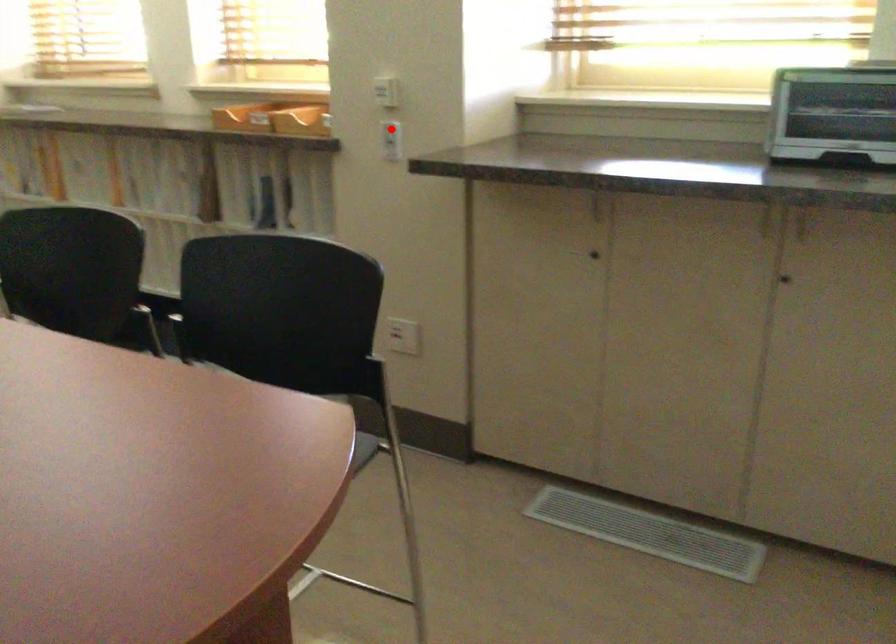
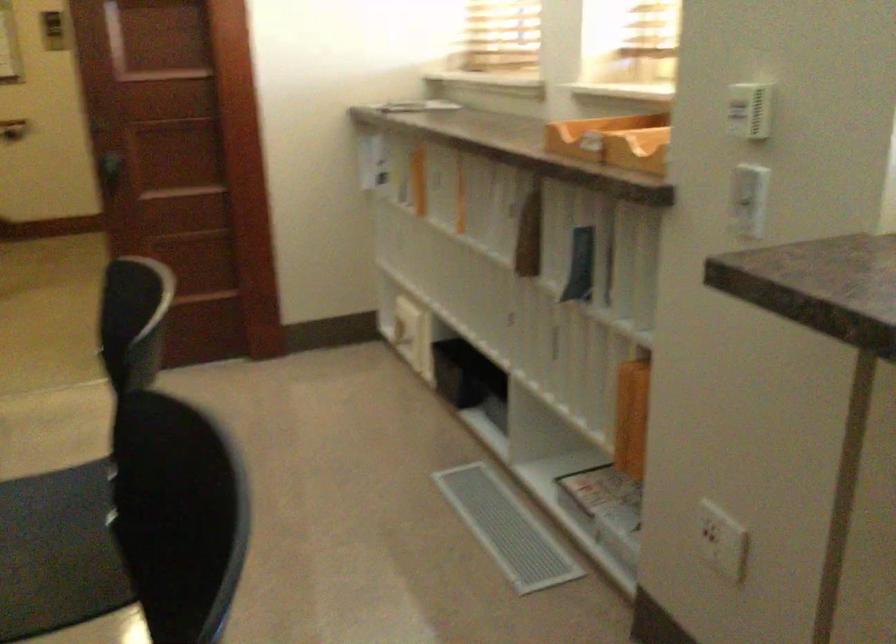
Where in the second image is the point corresponding to the highlighted location from the first image?

(748, 190)